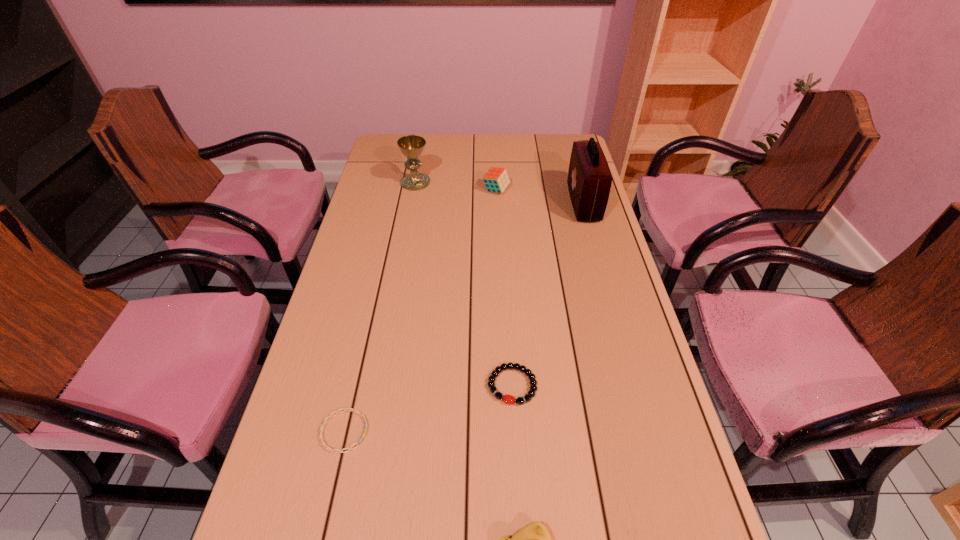
Locate an element on the screen. Image resolution: width=960 pixels, height=540 pixels. free space located 0.100m on the side of the tallest object with the cross symbol is located at coordinates (541, 203).

Where is `blank space located on the front of the chalice`? Image resolution: width=960 pixels, height=540 pixels. blank space located on the front of the chalice is located at coordinates (400, 263).

This screenshot has height=540, width=960. I want to click on free location located 0.240m on the right of the cube, so click(x=577, y=191).

Where is `free location located on the front of the farther bracelet`? free location located on the front of the farther bracelet is located at coordinates (517, 481).

Where is `vacant space located on the surface of the left bracelet showing star-shaped elements`? The width and height of the screenshot is (960, 540). vacant space located on the surface of the left bracelet showing star-shaped elements is located at coordinates (423, 431).

Locate an element on the screen. chalice that is positioned at the left edge is located at coordinates (411, 146).

Where is `bracelet that is at the left edge`? The width and height of the screenshot is (960, 540). bracelet that is at the left edge is located at coordinates (345, 409).

You are a GUI agent. You are given a task and a screenshot of the screen. Output one action in this format:
    pyautogui.click(x=<x>, y=<y>)
    Task: Click on the object present at the right edge
    This screenshot has width=960, height=540.
    Given the screenshot: What is the action you would take?
    pyautogui.click(x=589, y=181)

The width and height of the screenshot is (960, 540). In the image, there is a desktop. Find the location of `vacant space at the left edge`. vacant space at the left edge is located at coordinates (380, 269).

Where is `free space at the right edge`? The height and width of the screenshot is (540, 960). free space at the right edge is located at coordinates (561, 178).